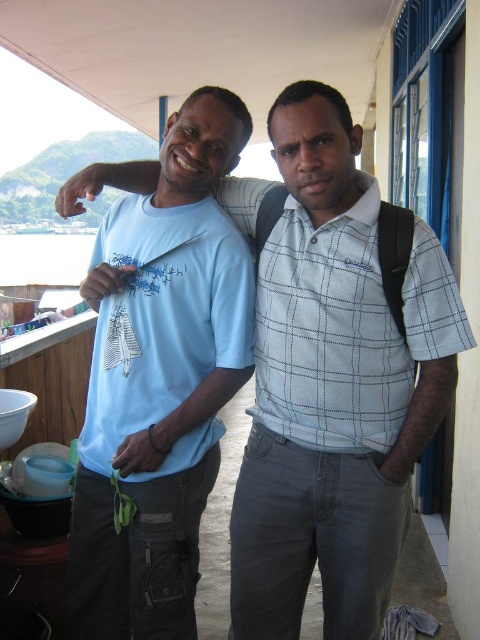
Is light blue checkered shirt at center closer to the viewer compared to light blue cotton t-shirt at center?

Yes, it is in front of light blue cotton t-shirt at center.

In the scene shown: Is light blue checkered shirt at center to the left of light blue cotton t-shirt at center from the viewer's perspective?

Incorrect, light blue checkered shirt at center is not on the left side of light blue cotton t-shirt at center.

Is point (336, 378) positioned after point (184, 272)?

No, it is not.

You are a GUI agent. You are given a task and a screenshot of the screen. Output one action in this format:
    pyautogui.click(x=<x>, y=<y>)
    Task: Click on the light blue checkered shirt at center
    This screenshot has height=640, width=480.
    Given the screenshot: What is the action you would take?
    pyautogui.click(x=347, y=326)

Which of these two, light blue cotton t-shirt at left or light blue cotton t-shirt at center, stands shorter?

light blue cotton t-shirt at center is shorter.

Does light blue cotton t-shirt at left have a lesser height compared to light blue cotton t-shirt at center?

No.

Locate an element on the screen. light blue cotton t-shirt at left is located at coordinates (159, 380).

Who is positioned more to the right, light blue cotton t-shirt at left or light blue checkered shirt at center?

light blue checkered shirt at center

You are a GUI agent. You are given a task and a screenshot of the screen. Output one action in this format:
    pyautogui.click(x=<x>, y=<y>)
    Task: Click on the light blue cotton t-shirt at left
    Image resolution: width=480 pixels, height=640 pixels.
    Given the screenshot: What is the action you would take?
    pyautogui.click(x=159, y=380)

Where is `light blue cotton t-shirt at left`? The height and width of the screenshot is (640, 480). light blue cotton t-shirt at left is located at coordinates (159, 380).